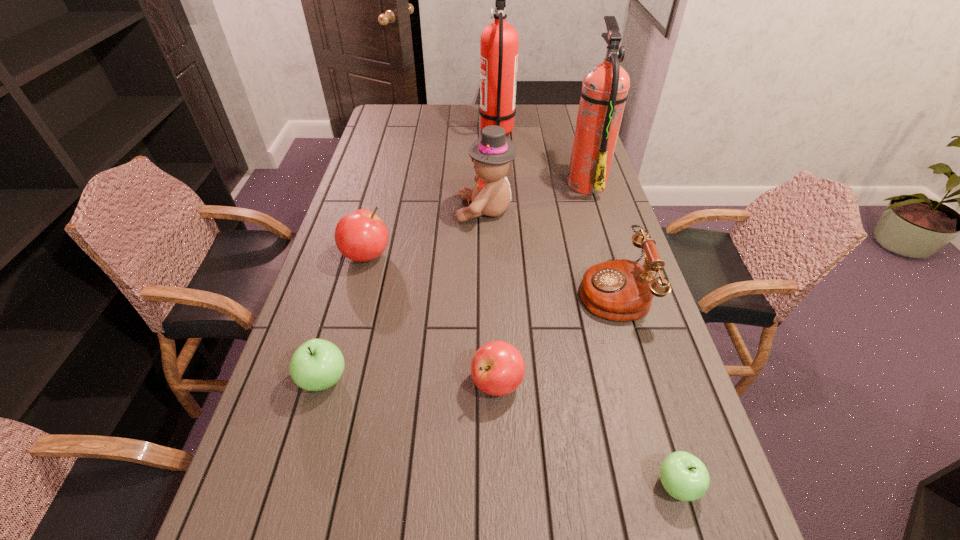
Identify the location of fire extinguisher that is at the right edge. (604, 92).

Identify the location of telephone at the right edge. Image resolution: width=960 pixels, height=540 pixels. (620, 290).

This screenshot has width=960, height=540. I want to click on apple present at the right edge, so tap(684, 477).

Find the location of a particular element. This screenshot has width=960, height=540. free location at the far edge is located at coordinates (535, 113).

Image resolution: width=960 pixels, height=540 pixels. In the image, there is a desktop. What are the coordinates of `vacant area at the left edge` in the screenshot? It's located at (260, 441).

Locate an element on the screen. The image size is (960, 540). vacant region at the right edge of the desktop is located at coordinates (683, 524).

At what (x,y) coordinates should I click in order to perform the action: click on vacant space at the far right corner of the desktop. Please return your answer as a coordinate pair (x, y). Looking at the image, I should click on (571, 120).

Find the location of `vacant space in between the shortest object and the sixth shortest object`. vacant space in between the shortest object and the sixth shortest object is located at coordinates (581, 348).

Find the location of a particular element. unoccupied position between the bigger green apple and the sixth shortest object is located at coordinates (404, 295).

Find the location of `free area in between the right fire extinguisher and the nearest object`. free area in between the right fire extinguisher and the nearest object is located at coordinates (632, 334).